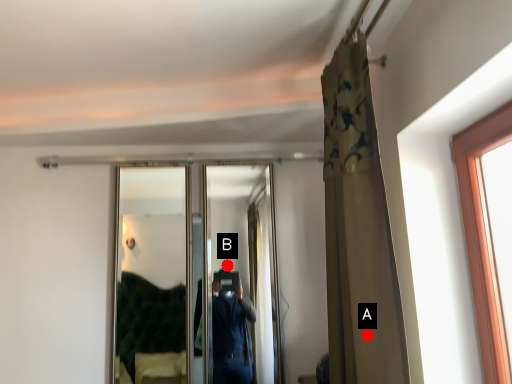
Question: Two points are circled on the image, labeled by A and B beside each circle. Which point appears closest to the camera in this image?

Choices:
 (A) A is closer
 (B) B is closer

Answer: (A)